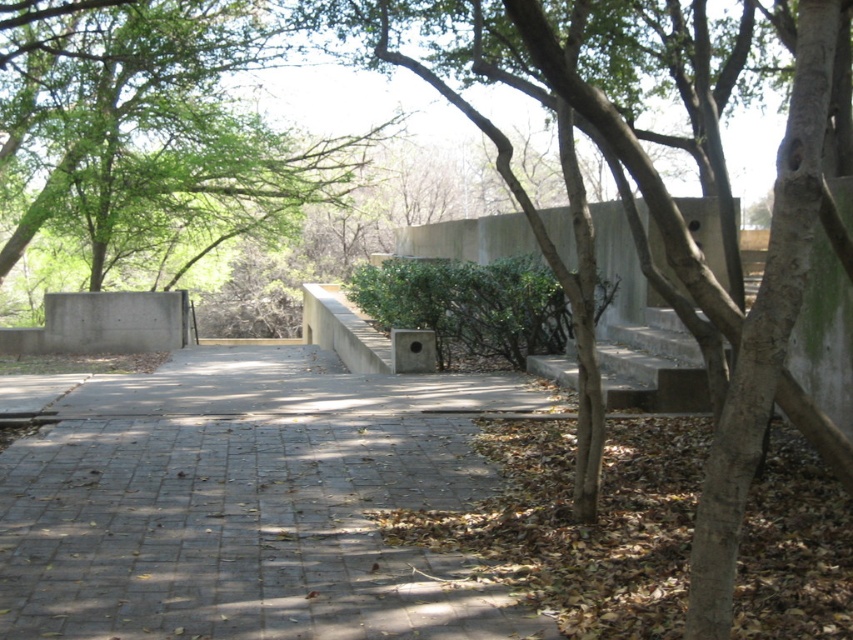
In the scene shown: You are standing at the entrance of the paved area and want to walk to the gray concrete pavement at center. According to the coordinates provided, in which direction should you move relative to your current position?

The gray concrete pavement at center is located at point (248,502), which means you should move towards the center of the image from your current position at the entrance.

Based on the photo, you are standing on the gray concrete pavement at center and want to move towards the concrete wall with the vent. Which direction should you walk to avoid the green matte hedge at center?

The gray concrete pavement at center is positioned under the green matte hedge at center, so to avoid it, you should walk around to the side opposite of the hedge.

You are standing on the gray concrete pavement at center and looking up. Which direction should you face to see the green leafy tree at center?

The gray concrete pavement at center is below the green leafy tree at center, so you should look upward to see the green leafy tree at center directly above you.